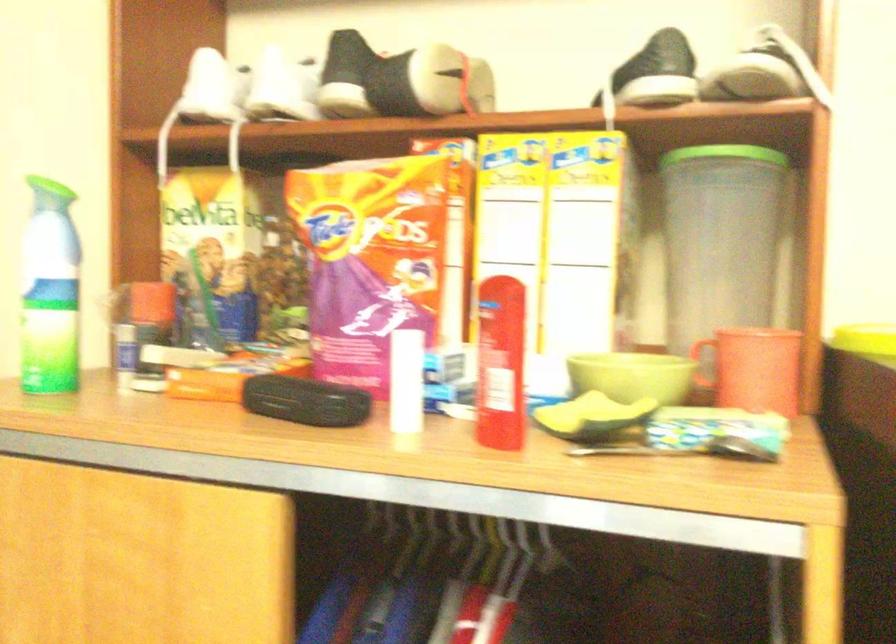
Where would you lift the light green bowl? Please return your answer as a coordinate pair (x, y).

(633, 375)